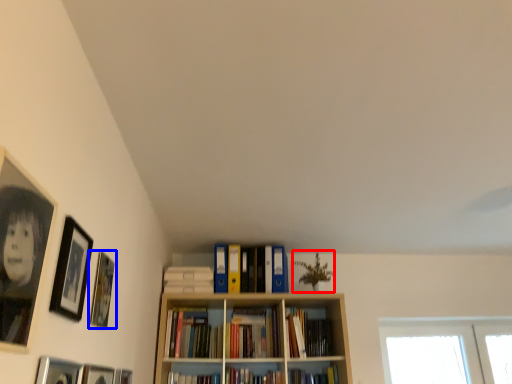
Question: Among these objects, which one is nearest to the camera, plant (highlighted by a red box) or picture frame (highlighted by a blue box)?

Choices:
 (A) plant
 (B) picture frame

Answer: (B)